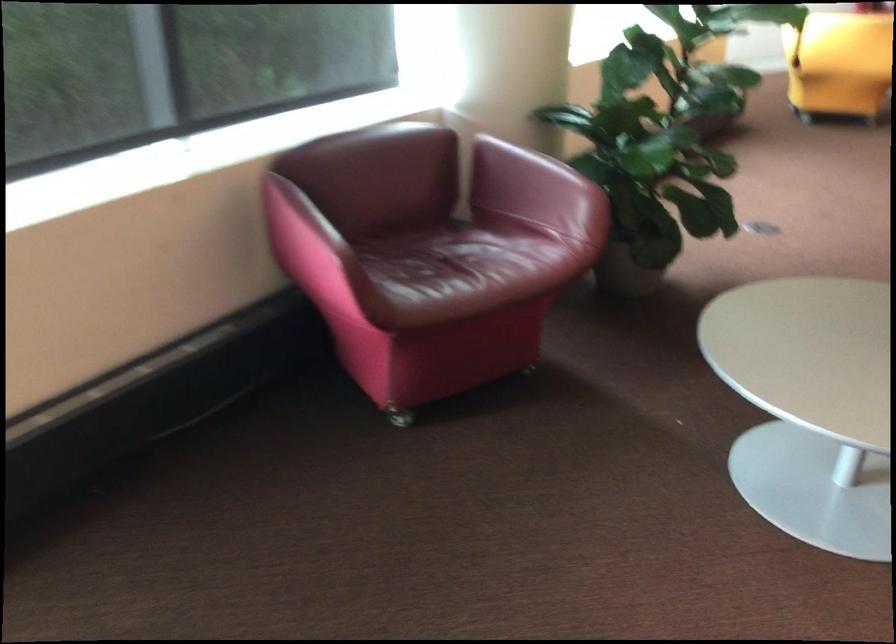
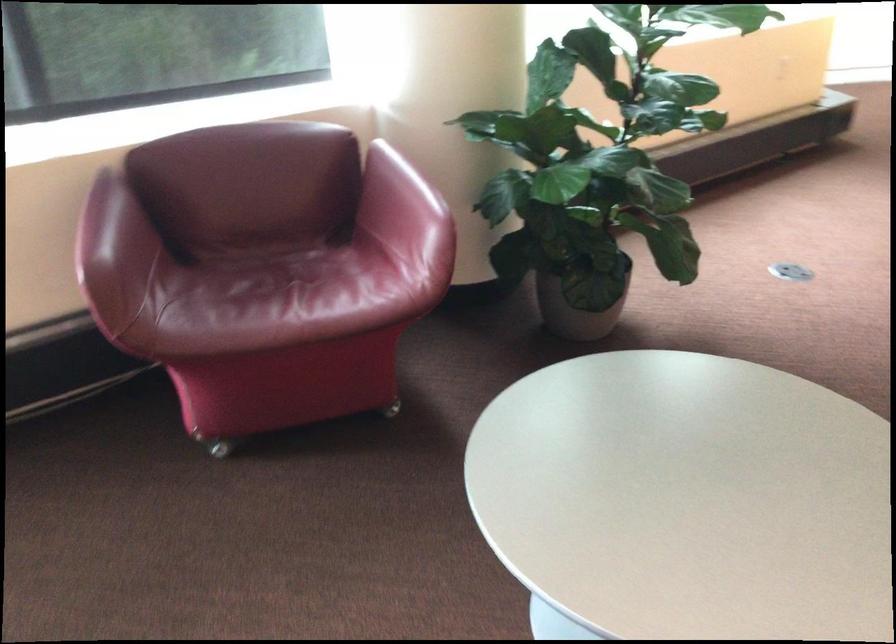
Question: The camera is either moving clockwise (left) or counter-clockwise (right) around the object. The first image is from the beginning of the video and the second image is from the end. Is the camera moving left or right when shooting the video?

Choices:
 (A) Left
 (B) Right

Answer: (B)